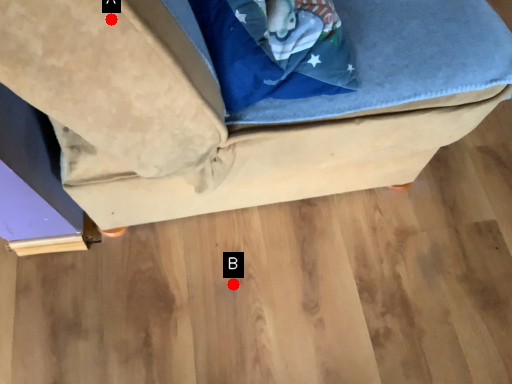
Question: Two points are circled on the image, labeled by A and B beside each circle. Which point is closer to the camera taking this photo?

Choices:
 (A) A is closer
 (B) B is closer

Answer: (A)